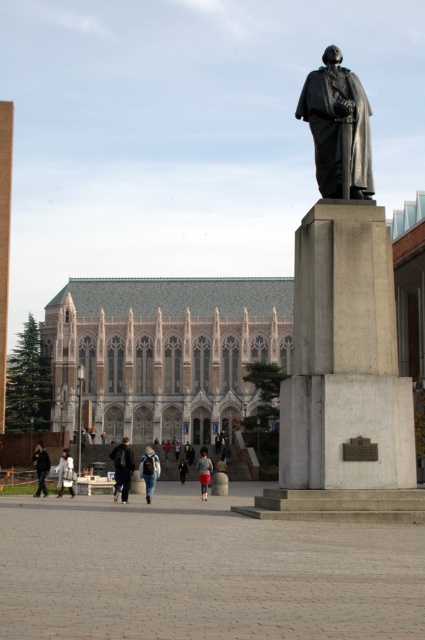
Who is lower down, matte black statue at center or gray fabric pants at center?

gray fabric pants at center is lower down.

Who is taller, matte black statue at center or gray fabric pants at center?

gray fabric pants at center

The image size is (425, 640). In order to click on matte black statue at center in this screenshot , I will do `click(337, 128)`.

Between point (209, 468) and point (184, 477), which one is positioned behind?

The point (184, 477) is more distant.

Can you confirm if gray fabric pants at center is thinner than dark gray jacket at center?

No.

This screenshot has width=425, height=640. What do you see at coordinates (204, 472) in the screenshot?
I see `gray fabric pants at center` at bounding box center [204, 472].

What are the coordinates of `gray fabric pants at center` in the screenshot? It's located at (204, 472).

Who is positioned more to the right, light gray fabric jacket at lower left or dark gray jacket at center?

Positioned to the right is dark gray jacket at center.

Between point (70, 467) and point (184, 474), which one is positioned in front?

Point (70, 467)

Image resolution: width=425 pixels, height=640 pixels. What are the coordinates of `light gray fabric jacket at lower left` in the screenshot? It's located at (65, 472).